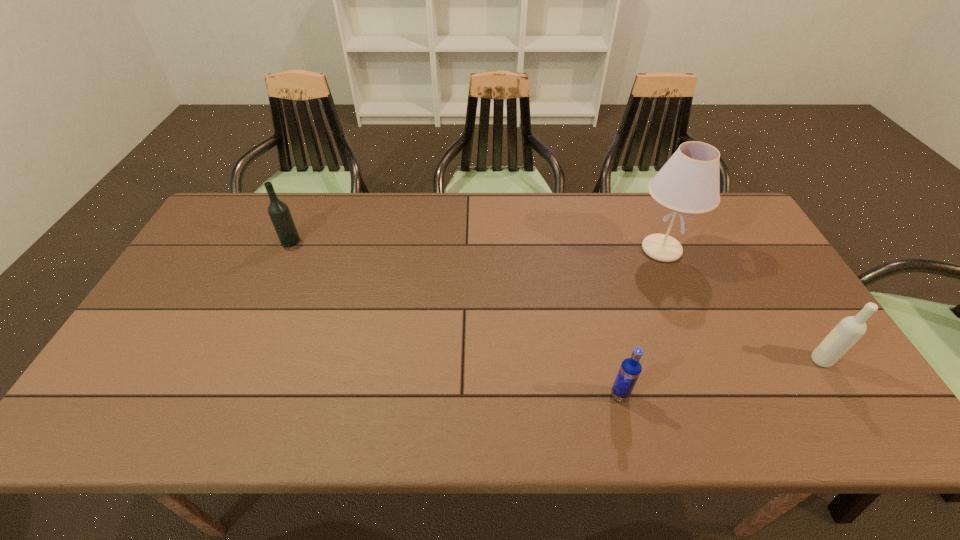
The height and width of the screenshot is (540, 960). Find the location of `vacant space located on the back of the rightmost vodka`. vacant space located on the back of the rightmost vodka is located at coordinates (767, 274).

Locate an element on the screen. This screenshot has height=540, width=960. free location located 0.190m on the left of the second object from left to right is located at coordinates (528, 395).

Find the location of a particular element. The width and height of the screenshot is (960, 540). lampshade that is positioned at the far edge is located at coordinates (689, 182).

The image size is (960, 540). What are the coordinates of `vodka at the far edge` in the screenshot? It's located at (279, 213).

This screenshot has width=960, height=540. Find the location of `object at the near edge`. object at the near edge is located at coordinates (630, 369).

Where is `object at the right edge`? This screenshot has width=960, height=540. object at the right edge is located at coordinates (849, 330).

Identify the location of vacant space at the far edge. (531, 220).

At what (x,y) coordinates should I click in order to perform the action: click on free point at the left edge. Please return your answer as a coordinate pair (x, y). Looking at the image, I should click on (132, 349).

Where is `vacant space at the right edge`? The image size is (960, 540). vacant space at the right edge is located at coordinates (768, 298).

The height and width of the screenshot is (540, 960). Identify the location of vacant space at the far left corner of the desktop. (227, 211).